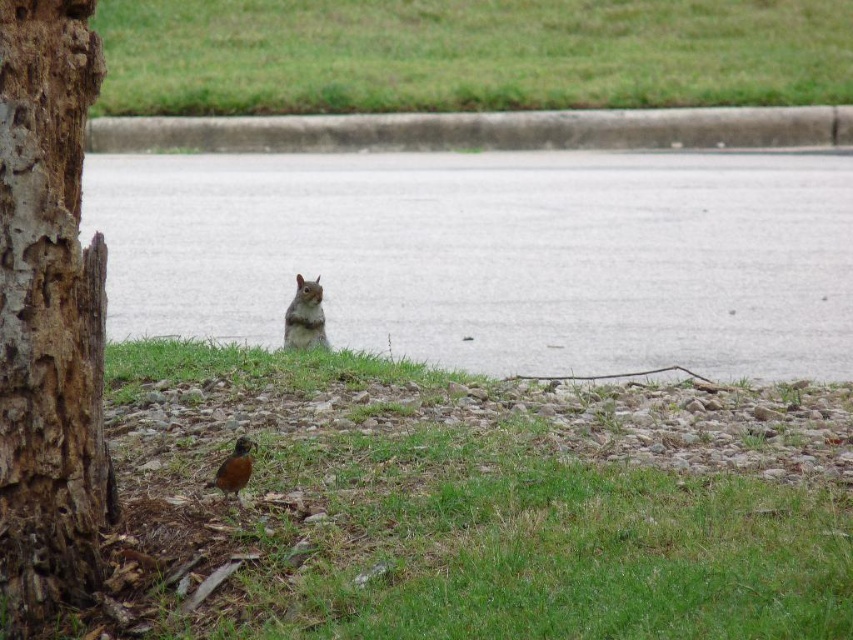
Looking at this image, you are a gardener looking at the image. You need to place a small decorative rock between the green grass at upper center and the concrete curb at upper center. Based on their positions, where should you place the rock?

The green grass at upper center is to the right of the concrete curb at upper center, so you should place the rock between them by positioning it to the right of the concrete curb at upper center and to the left of the green grass at upper center.

You are a gardener planning to plant flowers in the garden shown in the image. You need to place a flower pot between the green grass at lower center and the concrete curb at upper center. Based on their positions, where should you place the flower pot so that it is between them?

Since the green grass at lower center is below the concrete curb at upper center, you should place the flower pot between them by positioning it above the green grass at lower center and below the concrete curb at upper center.